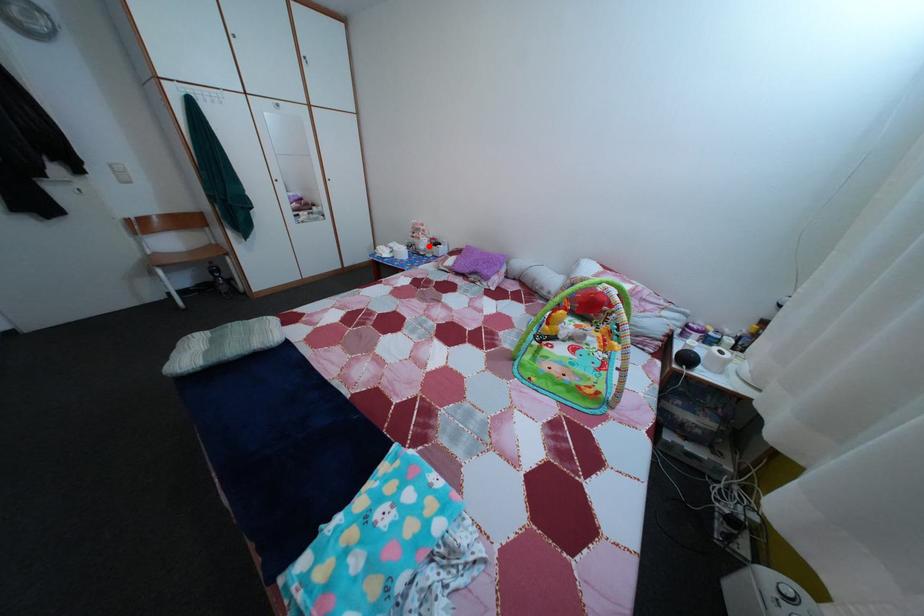
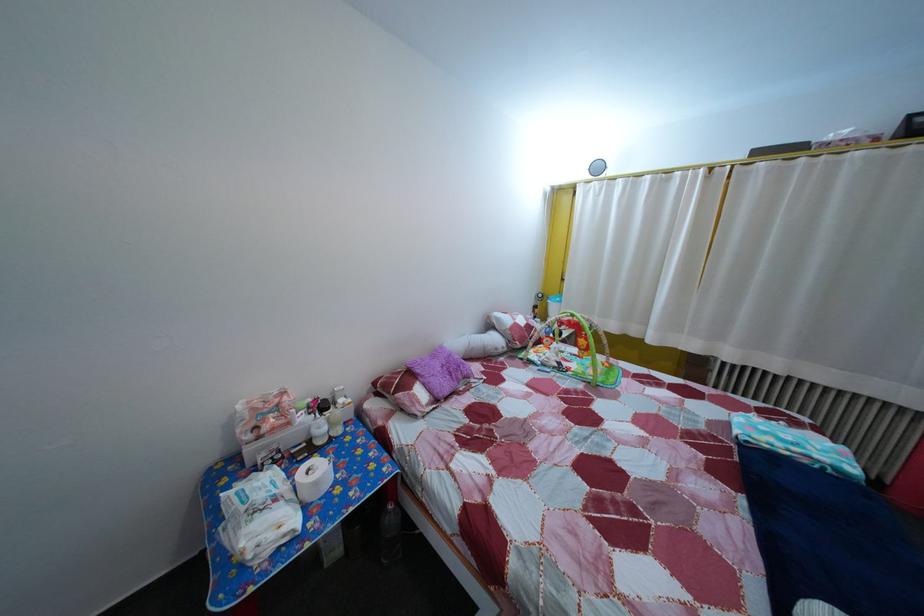
Locate, in the second image, the point that corresponds to the highlighted location in the first image.

(298, 432)